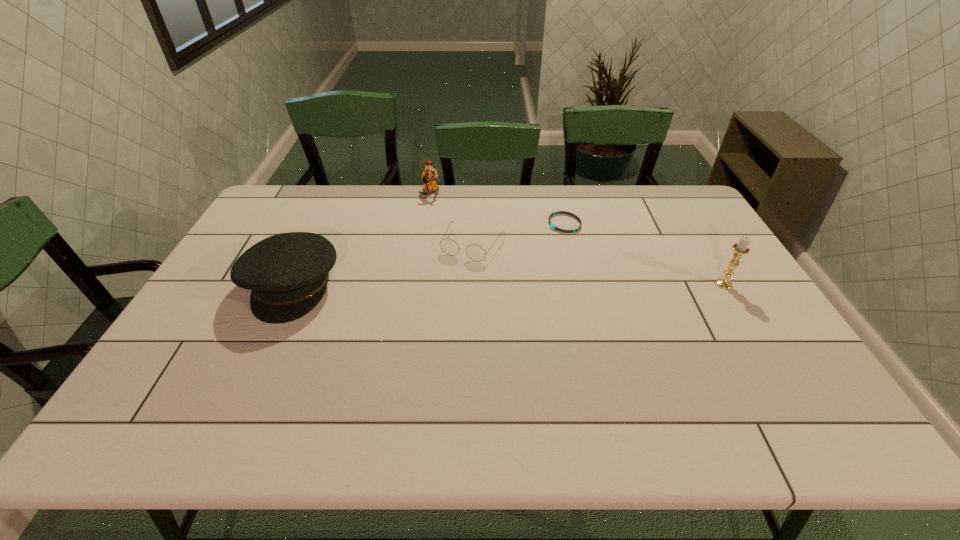
Find the location of `wristband at the far edge`. wristband at the far edge is located at coordinates (552, 225).

I want to click on Lego at the far edge, so click(x=429, y=175).

Locate an element on the screen. object positioned at the left edge is located at coordinates (287, 273).

This screenshot has width=960, height=540. I want to click on object that is at the right edge, so click(x=741, y=248).

You are a GUI agent. You are given a task and a screenshot of the screen. Output one action in this format:
    pyautogui.click(x=<x>, y=<y>)
    Task: Click on the blank area at the far edge
    
    Given the screenshot: What is the action you would take?
    pyautogui.click(x=495, y=218)

Find the location of a particular element. This screenshot has height=540, width=960. vacant region at the near edge of the desktop is located at coordinates (230, 362).

Find the location of `vacant point at the left edge`. vacant point at the left edge is located at coordinates (294, 225).

In the image, there is a desktop. At what (x,y) coordinates should I click in order to perform the action: click on free space at the near left corner. Please return your answer as a coordinate pair (x, y). Image resolution: width=960 pixels, height=540 pixels. Looking at the image, I should click on (160, 377).

Locate an element on the screen. free space at the far right corner is located at coordinates (681, 195).

In the image, there is a desktop. What are the coordinates of `blank space at the near right corner` in the screenshot? It's located at [795, 386].